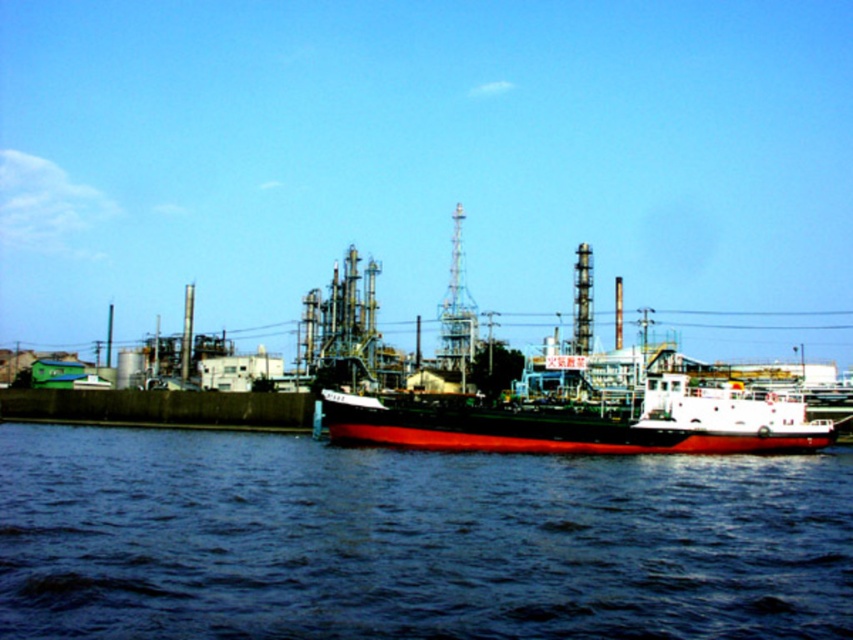
Question: Which object appears closest to the camera in this image?

Choices:
 (A) dark blue water at center
 (B) shiny black ship at center

Answer: (A)

Question: Can you confirm if dark blue water at center is thinner than shiny black ship at center?

Choices:
 (A) no
 (B) yes

Answer: (A)

Question: Which of the following is the farthest from the observer?

Choices:
 (A) (651, 461)
 (B) (660, 451)

Answer: (B)

Question: Can you confirm if dark blue water at center is bigger than shiny black ship at center?

Choices:
 (A) no
 (B) yes

Answer: (B)

Question: Considering the relative positions of dark blue water at center and shiny black ship at center in the image provided, where is dark blue water at center located with respect to shiny black ship at center?

Choices:
 (A) below
 (B) above

Answer: (A)

Question: Which point is farther to the camera?

Choices:
 (A) (680, 483)
 (B) (636, 420)

Answer: (B)